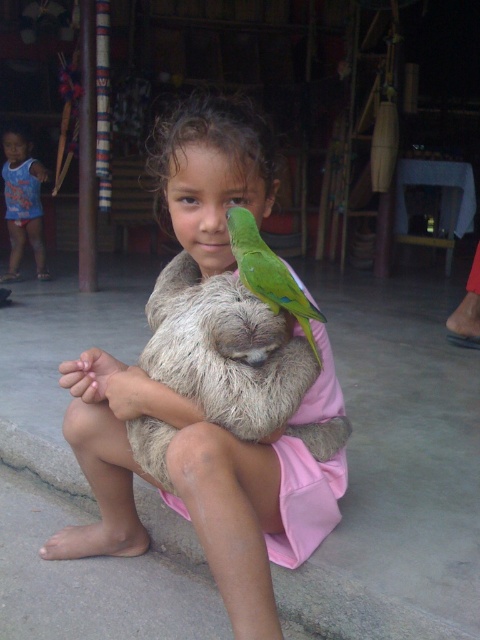
You are a photographer standing in front of the gray concrete curb at lower left and the green matte parrot at upper center. You want to take a photo of the parrot without the curb blocking the view. Which object should you move closer to or further away from to achieve this?

You should move closer to the green matte parrot at upper center because the gray concrete curb at lower left is currently closer to you, blocking the view. By moving towards the parrot, you can position yourself so the parrot is in front of the curb in the frame.

You are a photographer wanting to capture a closeup of the green matte parrot at upper center without including the gray concrete curb at lower left. Given their sizes, which object should you zoom in on more to ensure the parrot fills the frame while excluding the curb?

The gray concrete curb at lower left is larger in size than the green matte parrot at upper center, so you should zoom in more on the green matte parrot at upper center to fill the frame while excluding the larger curb.

You are a photographer trying to capture the sloth in the image. The sloth is located at the center of the image. There is a point at coordinates (196, 486). Where is this point located on the sloth?

The point at coordinates (196, 486) is on the fuzzy brown sloth at center.